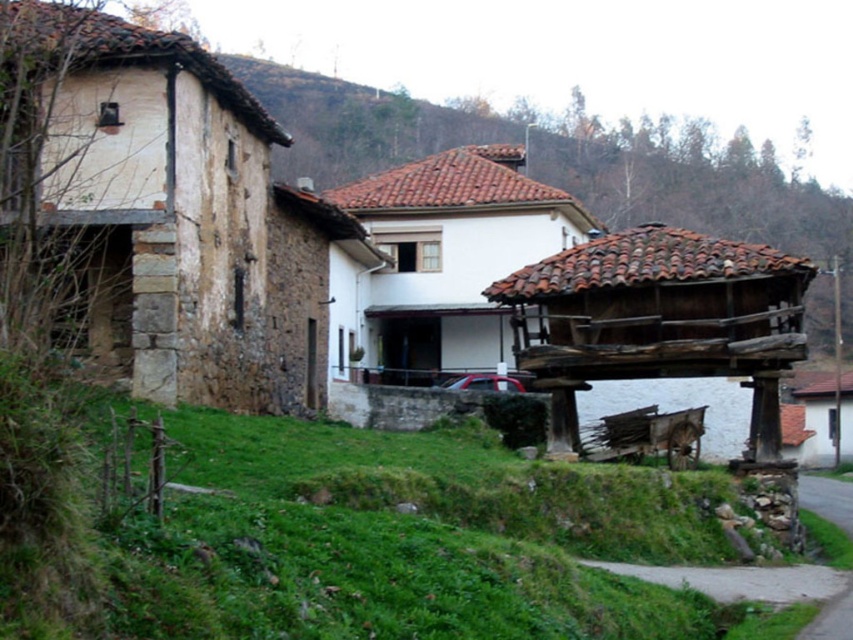
Who is more distant from viewer, (685, 180) or (471, 172)?

Positioned behind is point (685, 180).

Is brown stone house at center taller than white stucco house at center?

Yes.

Who is more distant from viewer, [293,76] or [480,225]?

Point [293,76]

At what (x,y) coordinates should I click in order to perform the action: click on brown stone house at center. Please return your answer as a coordinate pair (x, y). The height and width of the screenshot is (640, 853). Looking at the image, I should click on [700, 192].

Between stone textured hut at left and brown wooden hut at right, which one has less height?

brown wooden hut at right

The width and height of the screenshot is (853, 640). Describe the element at coordinates (184, 218) in the screenshot. I see `stone textured hut at left` at that location.

This screenshot has height=640, width=853. What do you see at coordinates (184, 218) in the screenshot?
I see `stone textured hut at left` at bounding box center [184, 218].

Where is `stone textured hut at left`? Image resolution: width=853 pixels, height=640 pixels. stone textured hut at left is located at coordinates (184, 218).

Describe the element at coordinates (448, 259) in the screenshot. I see `white stucco house at center` at that location.

Is white stucco house at center positioned before brown wooden hut at right?

That is True.

Between point (387, 352) and point (805, 394), which one is positioned behind?

The point (805, 394) is behind.

Where is `white stucco house at center`? Image resolution: width=853 pixels, height=640 pixels. white stucco house at center is located at coordinates (448, 259).